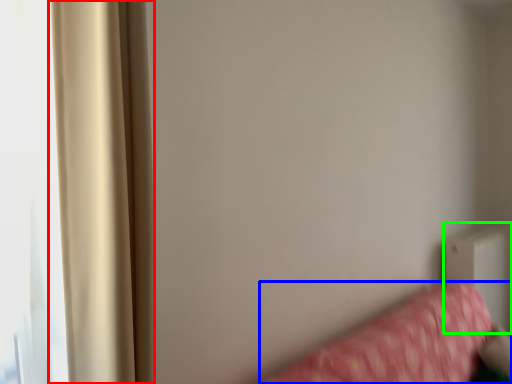
Question: Based on their relative distances, which object is farther from curtain (highlighted by a red box)? Choose from furniture (highlighted by a blue box) and radiator (highlighted by a green box).

Choices:
 (A) furniture
 (B) radiator

Answer: (B)